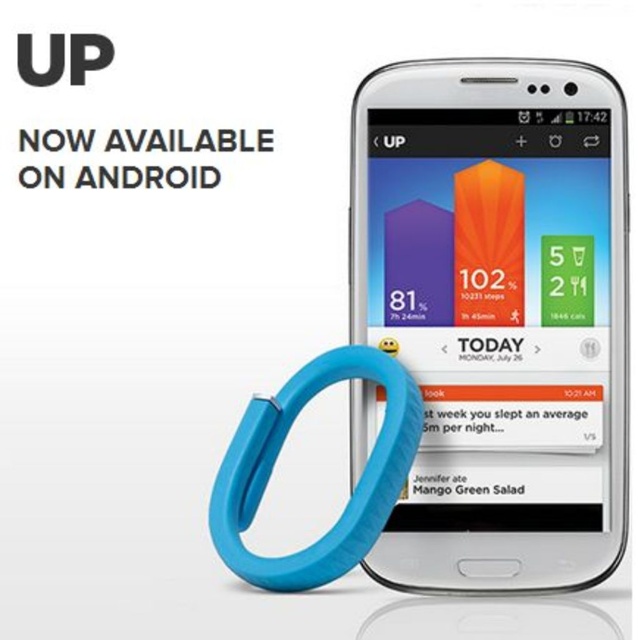
You are designing a poster and need to place a logo in the bottom right corner of the white glossy smartphone at center. According to the coordinates provided, will the logo fit within the smartphone screen if the logo is 0.1 units wide and 0.05 units tall?

The white glossy smartphone at center is located at point (498, 314). Since the logo is 0.1 units wide and 0.05 units tall, and the smartphone screen has sufficient space in those dimensions, the logo should fit within the smartphone screen.

You are holding an Android smartphone displaying a fitness tracker app. The app has a bar graph with three colored sections. There is also a point labeled at coordinates (493, 372). If you want to take a photo of this point using your phone camera, will the point be in focus? Please consider the distance between the point and the camera.

The point labeled at coordinates (493, 372) is 28.88 inches away from the camera. Since this distance is within the typical focusing range of a smartphone camera, the point should be in focus when you take the photo.

You are holding a white glossy smartphone at center and want to place it next to a blue rubber band at lower left on a table. The table is only 5 inches wide. Will the smartphone and the rubber band fit side by side without overlapping?

The white glossy smartphone at center and blue rubber band at lower left are 4.91 inches apart, so they can fit side by side on the 5 inch wide table without overlapping since the total required space is less than the table width.